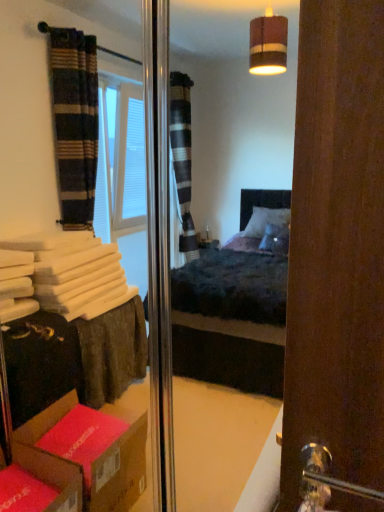
This screenshot has height=512, width=384. What do you see at coordinates (325, 480) in the screenshot? I see `silver metallic door handle at lower right` at bounding box center [325, 480].

Identify the location of silver metallic door handle at lower right. This screenshot has width=384, height=512. point(325,480).

The width and height of the screenshot is (384, 512). Identify the location of cardboard box at lower left. (39, 483).

Describe the element at coordinates (39, 483) in the screenshot. The width and height of the screenshot is (384, 512). I see `cardboard box at lower left` at that location.

The width and height of the screenshot is (384, 512). Find the location of `silver metallic door handle at lower right`. silver metallic door handle at lower right is located at coordinates (325, 480).

Is silver metallic door handle at lower right to the left or to the right of cardboard box at lower left in the image?

silver metallic door handle at lower right is positioned on cardboard box at lower left's right side.

Considering their positions, is silver metallic door handle at lower right located in front of or behind cardboard box at lower left?

In the image, silver metallic door handle at lower right appears in front of cardboard box at lower left.

Which is less distant, (323, 488) or (44, 499)?

The point (323, 488) is more forward.

From the image's perspective, which object appears higher, silver metallic door handle at lower right or cardboard box at lower left?

silver metallic door handle at lower right.

From the picture: From a real-world perspective, between silver metallic door handle at lower right and cardboard box at lower left, who is vertically lower?

cardboard box at lower left.

Can you confirm if silver metallic door handle at lower right is thinner than cardboard box at lower left?

Correct, the width of silver metallic door handle at lower right is less than that of cardboard box at lower left.

Between silver metallic door handle at lower right and cardboard box at lower left, which one has more height?

silver metallic door handle at lower right.

Does silver metallic door handle at lower right have a smaller size compared to cardboard box at lower left?

Correct, silver metallic door handle at lower right occupies less space than cardboard box at lower left.

Looking at this image, is silver metallic door handle at lower right inside or outside of cardboard box at lower left?

silver metallic door handle at lower right exists outside the volume of cardboard box at lower left.

Is silver metallic door handle at lower right far away from cardboard box at lower left?

Absolutely, silver metallic door handle at lower right is distant from cardboard box at lower left.

Is silver metallic door handle at lower right turned away from cardboard box at lower left?

No, silver metallic door handle at lower right is not facing the opposite direction of cardboard box at lower left.

How many degrees apart are the facing directions of silver metallic door handle at lower right and cardboard box at lower left?

They differ by 9.62 degrees in their facing directions.

Identify the location of door handle that is on the right side of cardboard box at lower left. (325, 480).

Between cardboard box at lower left and silver metallic door handle at lower right, which one appears on the left side from the viewer's perspective?

Positioned to the left is cardboard box at lower left.

From the picture: Is cardboard box at lower left positioned in front of silver metallic door handle at lower right?

No, cardboard box at lower left is further to the viewer.

Does point (31, 489) appear closer or farther from the camera than point (321, 487)?

Clearly, point (31, 489) is more distant from the camera than point (321, 487).

From the image's perspective, does cardboard box at lower left appear higher than silver metallic door handle at lower right?

Incorrect, from the image's perspective, cardboard box at lower left is lower than silver metallic door handle at lower right.

From a real-world perspective, who is located higher, cardboard box at lower left or silver metallic door handle at lower right?

silver metallic door handle at lower right is physically above.

Is cardboard box at lower left thinner than silver metallic door handle at lower right?

Incorrect, the width of cardboard box at lower left is not less than that of silver metallic door handle at lower right.

Which of these two, cardboard box at lower left or silver metallic door handle at lower right, stands taller?

Standing taller between the two is silver metallic door handle at lower right.

Considering the sizes of objects cardboard box at lower left and silver metallic door handle at lower right in the image provided, who is smaller, cardboard box at lower left or silver metallic door handle at lower right?

silver metallic door handle at lower right is smaller.

Is cardboard box at lower left located outside silver metallic door handle at lower right?

Yes, cardboard box at lower left is not within silver metallic door handle at lower right.

Is cardboard box at lower left far from silver metallic door handle at lower right?

Indeed, cardboard box at lower left is not near silver metallic door handle at lower right.

Does cardboard box at lower left turn towards silver metallic door handle at lower right?

No, cardboard box at lower left does not turn towards silver metallic door handle at lower right.

Can you tell me how much cardboard box at lower left and silver metallic door handle at lower right differ in facing direction?

9.62 degrees.

Locate an element on the screen. This screenshot has height=512, width=384. door handle above the cardboard box at lower left (from a real-world perspective) is located at coordinates (325, 480).

You are a GUI agent. You are given a task and a screenshot of the screen. Output one action in this format:
    pyautogui.click(x=<x>, y=<y>)
    Task: Click on the cardboard box behind the silver metallic door handle at lower right
    The height and width of the screenshot is (512, 384).
    Given the screenshot: What is the action you would take?
    pyautogui.click(x=39, y=483)

The width and height of the screenshot is (384, 512). In order to click on door handle located above the cardboard box at lower left (from the image's perspective) in this screenshot , I will do `click(325, 480)`.